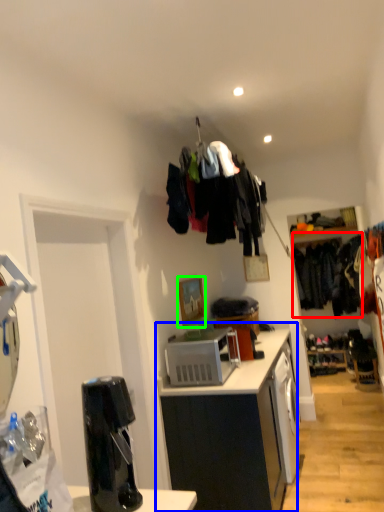
Question: Which object is the closest to the clothing (highlighted by a red box)? Choose among these: cabinetry (highlighted by a blue box) or picture frame (highlighted by a green box).

Choices:
 (A) cabinetry
 (B) picture frame

Answer: (B)